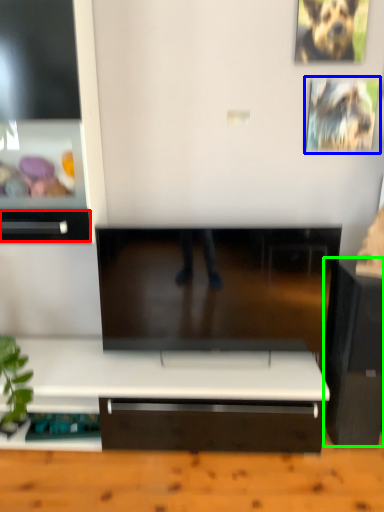
Question: Based on their relative distances, which object is farther from drawer (highlighted by a red box)? Choose from picture frame (highlighted by a blue box) and furniture (highlighted by a green box).

Choices:
 (A) picture frame
 (B) furniture

Answer: (B)